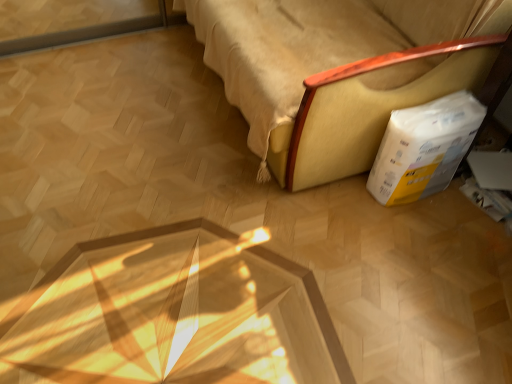
Identify the location of spots to the right of white/yellow cardboard box at lower right. This screenshot has width=512, height=384. pyautogui.click(x=463, y=210).